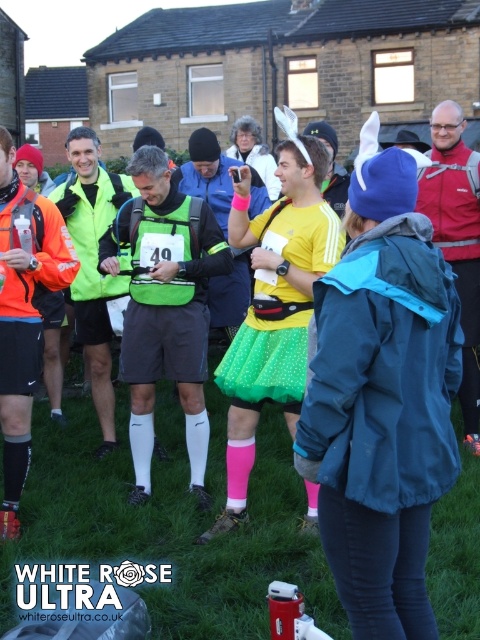
Question: Does green tulle skirt at center come behind green matte vest at center?

Choices:
 (A) yes
 (B) no

Answer: (B)

Question: Is green tulle skirt at center closer to camera compared to green matte vest at center?

Choices:
 (A) no
 (B) yes

Answer: (B)

Question: Which point is farther to the camera?

Choices:
 (A) green tulle skirt at center
 (B) green polka dot skirt at center

Answer: (A)

Question: Which object appears closest to the camera in this image?

Choices:
 (A) green matte vest at center
 (B) green polka dot skirt at center

Answer: (B)

Question: Which point is closer to the camera?

Choices:
 (A) green tulle skirt at center
 (B) green polka dot skirt at center

Answer: (B)

Question: Is green tulle skirt at center further to camera compared to green matte vest at center?

Choices:
 (A) no
 (B) yes

Answer: (A)